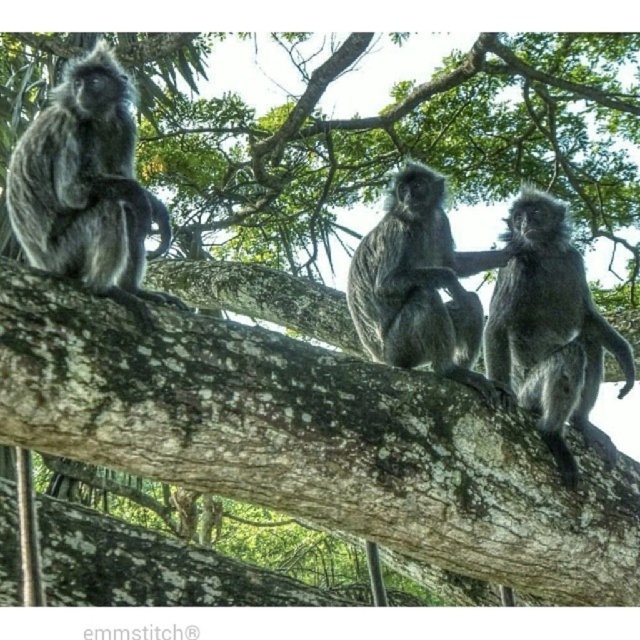
Question: Which point is closer to the camera taking this photo?

Choices:
 (A) (74, 202)
 (B) (353, 294)
 (C) (554, 394)

Answer: (A)

Question: Among these points, which one is farthest from the camera?

Choices:
 (A) (113, 122)
 (B) (497, 316)

Answer: (B)

Question: From the image, what is the correct spatial relationship of silvery fur monkey at left in relation to silvery fur monkey at center?

Choices:
 (A) below
 (B) above

Answer: (B)

Question: Does silvery fur monkey at left appear over silvery fur monkey at right?

Choices:
 (A) yes
 (B) no

Answer: (A)

Question: Which of the following is the closest to the observer?

Choices:
 (A) silvery fur monkey at left
 (B) silvery fur monkey at right
 (C) silvery fur monkey at center

Answer: (A)

Question: Does silvery fur monkey at left have a smaller size compared to silvery fur monkey at center?

Choices:
 (A) no
 (B) yes

Answer: (B)